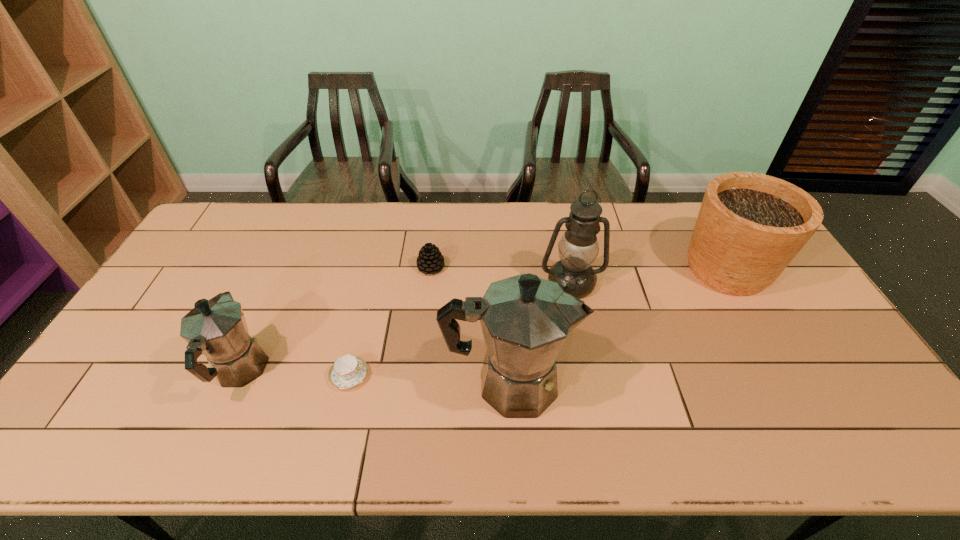
Find the location of a particular element. The height and width of the screenshot is (540, 960). the shorter coffeepot is located at coordinates (217, 329).

In order to click on the leftmost object in this screenshot , I will do click(217, 329).

Identify the location of the taller coffeepot. The image size is (960, 540). (525, 320).

The height and width of the screenshot is (540, 960). In order to click on the fifth tallest object in this screenshot , I will do `click(430, 260)`.

This screenshot has height=540, width=960. I want to click on pinecone, so click(x=430, y=260).

Where is `the rightmost object`? the rightmost object is located at coordinates pyautogui.click(x=750, y=226).

I want to click on teacup, so click(348, 371).

Image resolution: width=960 pixels, height=540 pixels. I want to click on the second object from left to right, so click(348, 371).

You are a GUI agent. You are given a task and a screenshot of the screen. Output one action in this format:
    pyautogui.click(x=<x>, y=<y>)
    Task: Click on the oil lamp
    The image size is (960, 540).
    Given the screenshot: What is the action you would take?
    pyautogui.click(x=578, y=248)

Find the location of a particular element. vacant region located 0.240m on the pouring side of the left coffeepot is located at coordinates (282, 276).